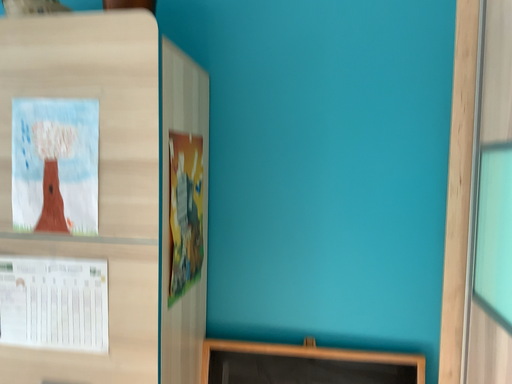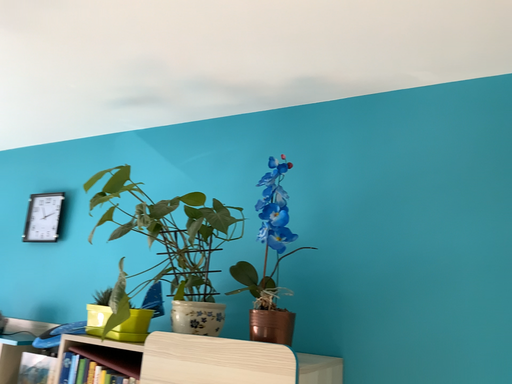
Question: Which way did the camera rotate in the video?

Choices:
 (A) rotated right
 (B) rotated left

Answer: (B)